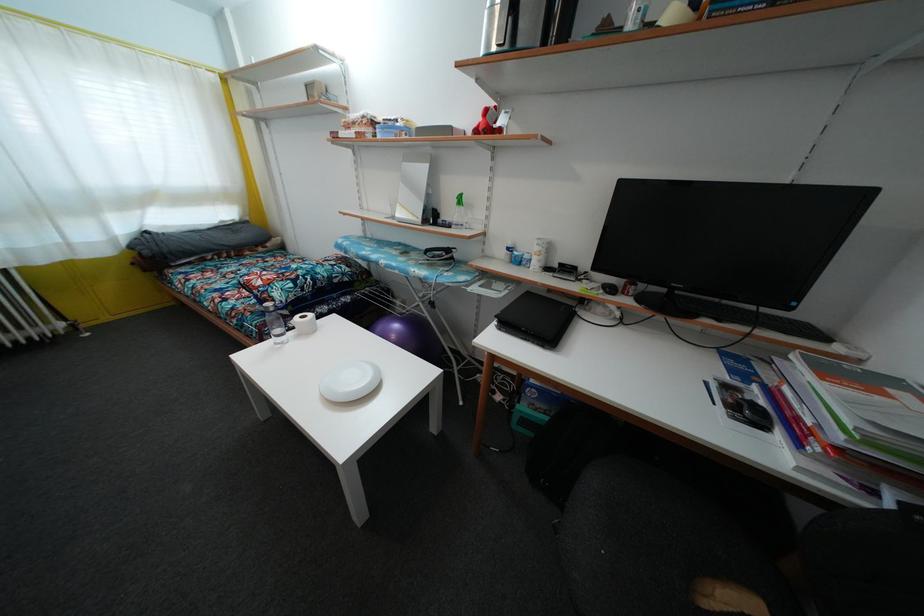
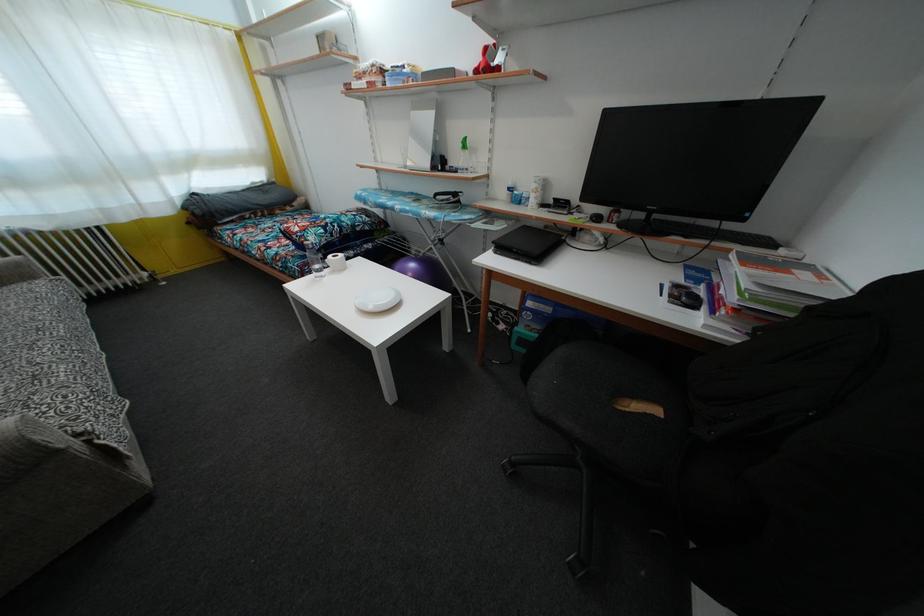
Where in the second image is the point corresponding to [399,333] from the first image?

(416, 272)